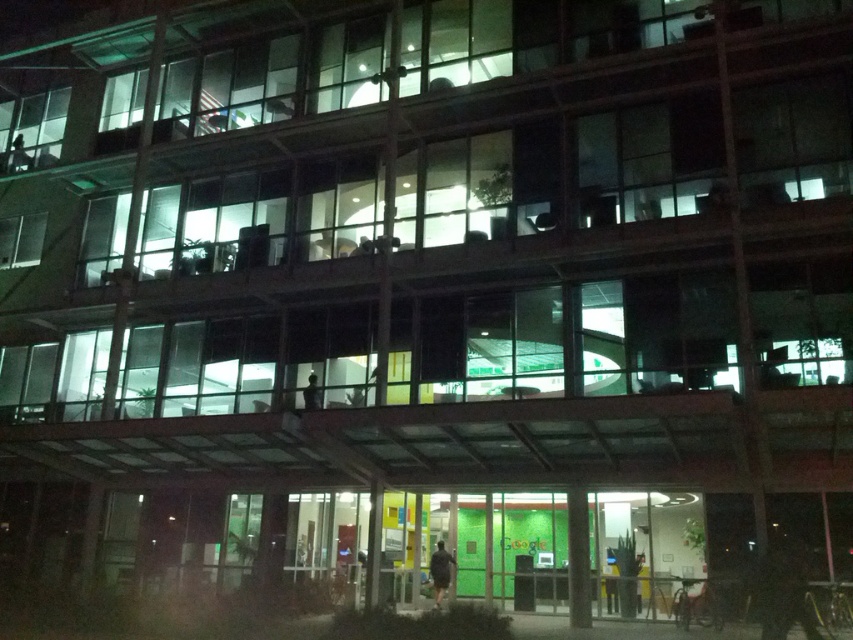
You are standing outside the Google office building and see the dark gray fabric jacket at lower center and the smooth black figure at center. Which object is closer to you?

The dark gray fabric jacket at lower center is closer to you because it is in front of the smooth black figure at center.

You are standing outside the Google office building and see the dark gray fabric jacket at lower center and the smooth black figure at center. Which object is positioned more to the right side?

The dark gray fabric jacket at lower center is positioned more to the right than the smooth black figure at center.

You are a visitor approaching the Google office entrance. You see a dark gray fabric jacket at lower center and a smooth black figure at center. Which object is taller?

The dark gray fabric jacket at lower center is much taller than the smooth black figure at center.